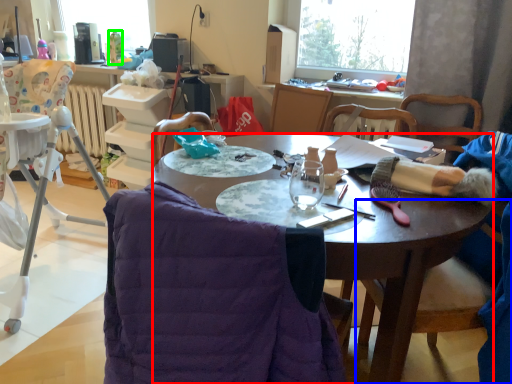
Question: Based on their relative distances, which object is nearer to desk (highlighted by a red box)? Choose from chair (highlighted by a blue box) and bottle (highlighted by a green box).

Choices:
 (A) chair
 (B) bottle

Answer: (A)